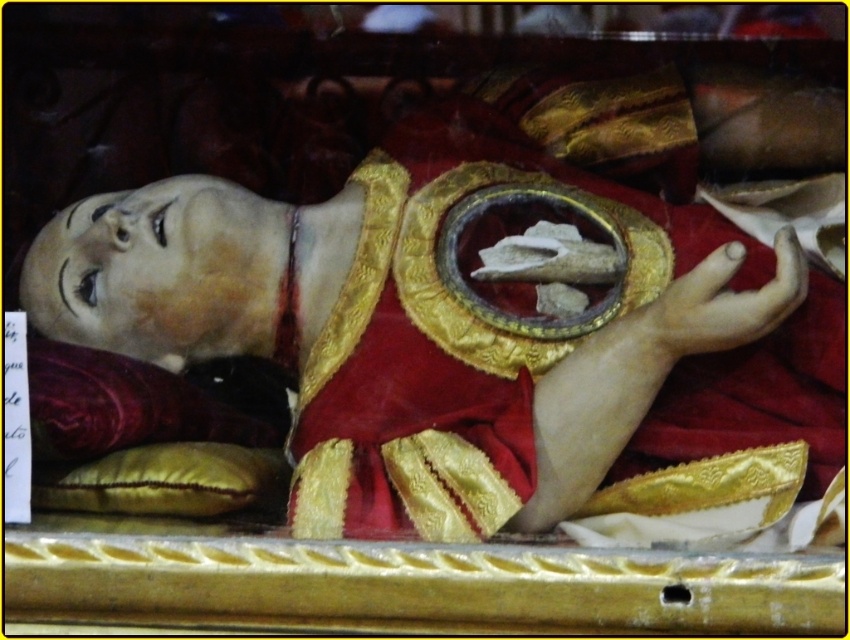
Does yellow fabric pillow at lower left appear under matte gold hand at lower right?

Yes.

Does point (199, 486) lie behind point (761, 312)?

Yes.

Image resolution: width=850 pixels, height=640 pixels. I want to click on yellow fabric pillow at lower left, so click(x=165, y=481).

Which is more to the left, velvet cushion at lower left or yellow fabric pillow at lower left?

Positioned to the left is velvet cushion at lower left.

Does point (85, 353) lie behind point (58, 476)?

No, (85, 353) is closer to viewer.

Identify the location of velvet cushion at lower left. This screenshot has width=850, height=640. (146, 401).

Does matte gold statue at center have a larger size compared to velvet cushion at lower left?

Yes, matte gold statue at center is bigger than velvet cushion at lower left.

Is point (469, 195) more distant than point (91, 422)?

That is True.

Who is more forward, (x=695, y=374) or (x=160, y=435)?

Point (x=695, y=374) is in front.

I want to click on matte gold statue at center, so click(469, 316).